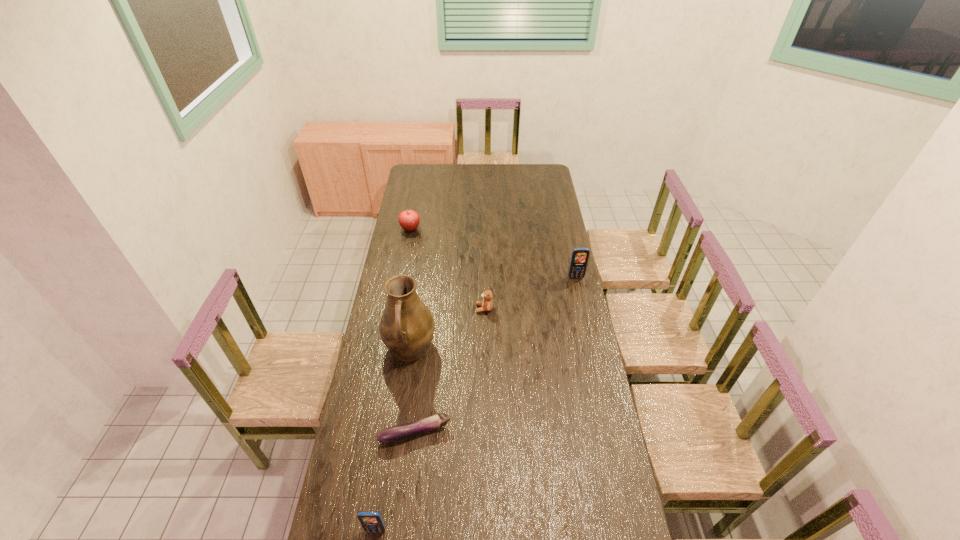
Locate an element on the screen. apple situated at the left edge is located at coordinates click(x=409, y=220).

Where is `pitcher that is positioned at the left edge`? This screenshot has width=960, height=540. pitcher that is positioned at the left edge is located at coordinates click(x=407, y=326).

Where is `eggplant located at the left edge`? The height and width of the screenshot is (540, 960). eggplant located at the left edge is located at coordinates (396, 433).

Locate an element on the screen. object that is at the right edge is located at coordinates pyautogui.click(x=580, y=256).

Identify the location of object that is at the near left corner. The width and height of the screenshot is (960, 540). (371, 521).

Locate an element on the screen. vacant area at the far edge of the desktop is located at coordinates (518, 165).

Where is `vacant region at the near edge`? vacant region at the near edge is located at coordinates (503, 531).

Image resolution: width=960 pixels, height=540 pixels. I want to click on vacant space at the left edge of the desktop, so click(x=364, y=480).

Where is `free space at the right edge of the desktop`? The image size is (960, 540). free space at the right edge of the desktop is located at coordinates (542, 244).

You are a GUI agent. You are given a task and a screenshot of the screen. Output one action in this format:
    pyautogui.click(x=<x>, y=<y>)
    Task: Click on the vacant area at the far right corner of the desktop
    
    Given the screenshot: What is the action you would take?
    pyautogui.click(x=536, y=174)